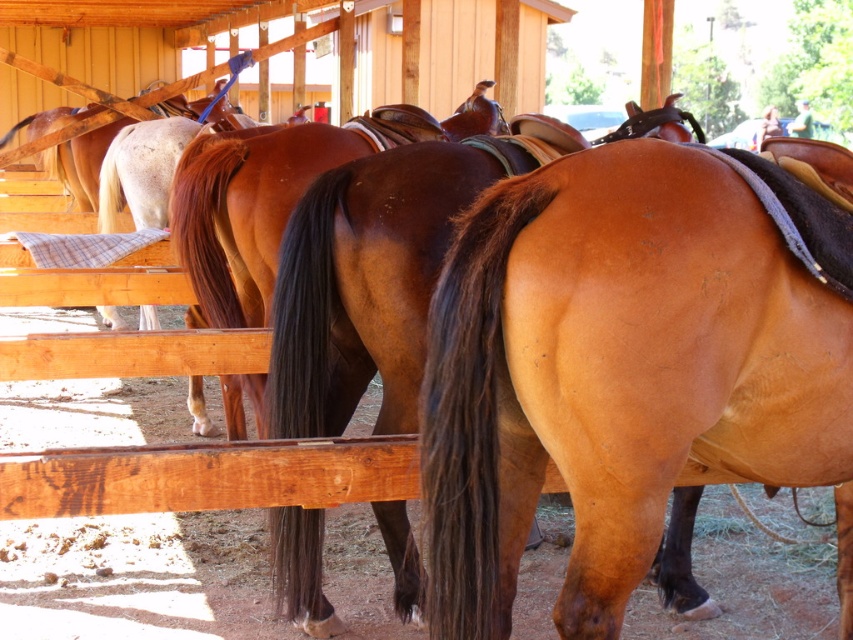
You are standing in the stable and see the saddle brown horse at center and the shiny brown horse at center. Which horse is positioned more to your right?

The saddle brown horse at center is positioned to the right of the shiny brown horse at center, so the saddle brown horse at center is more to the right.

You are a stable hand checking the saddles on the horses. You notice a point marked at coordinates [618,376]. Which horse is this point located on?

The point at [618,376] is on the saddle of the brown horse at center.

You are a stable worker checking the horses. You need to know which horse has a narrower body between the saddle brown horse at center and the brown glossy horse at center. Which one is it?

The saddle brown horse at center is thinner than the brown glossy horse at center, so the saddle brown horse at center has a narrower body.